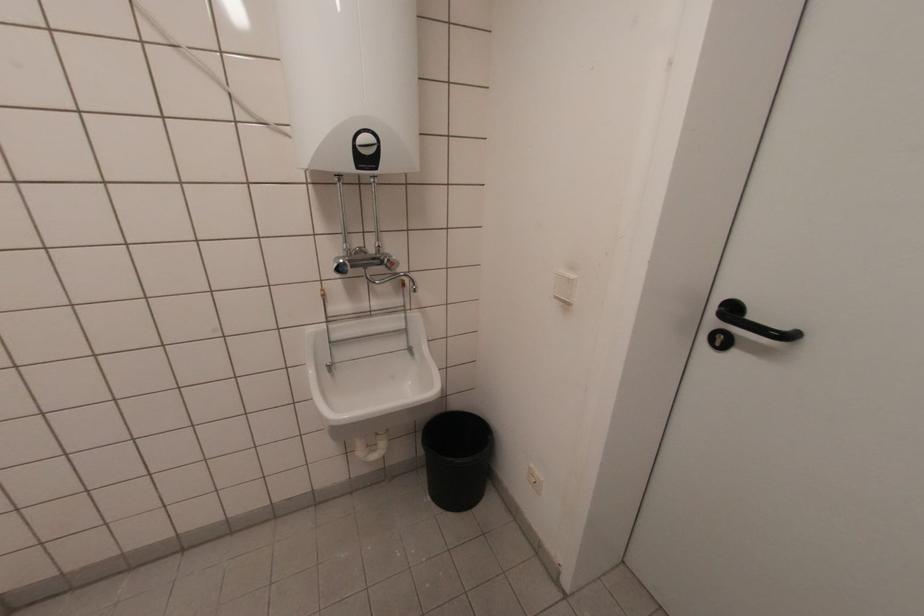
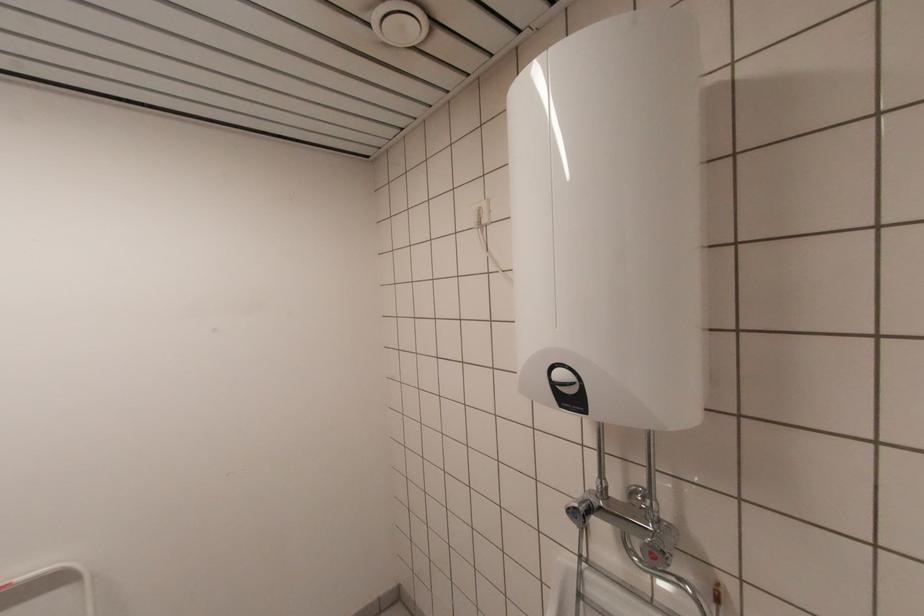
Question: How did the camera likely rotate?

Choices:
 (A) Left
 (B) Right
 (C) Up
 (D) Down

Answer: (A)